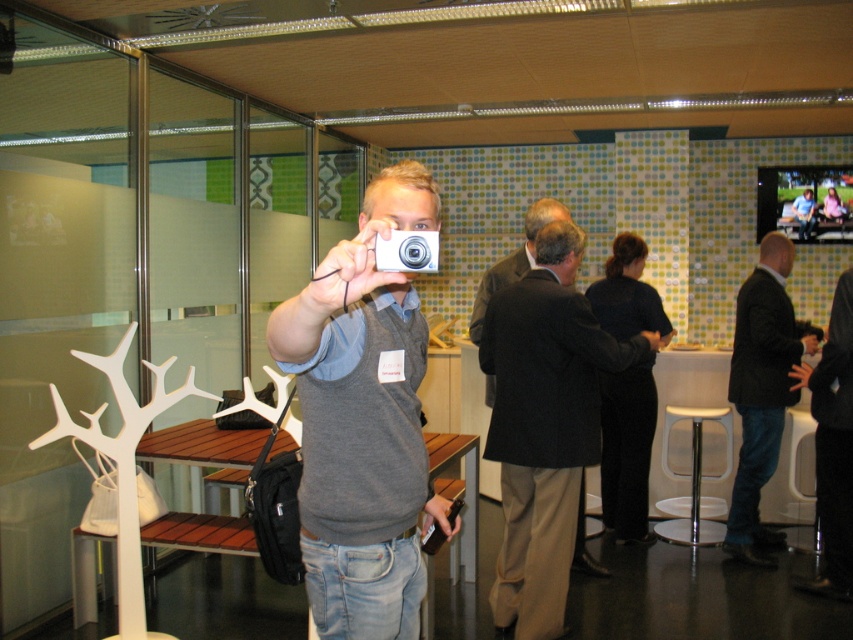
Question: Which object is the farthest from the white plastic stool at lower right?

Choices:
 (A) dark brown leather jacket at right
 (B) silver metallic camera at center
 (C) dark brown suit at center

Answer: (B)

Question: Considering the real-world distances, which object is closest to the dark brown leather jacket at right?

Choices:
 (A) white plastic stool at lower right
 (B) silver metallic camera at center
 (C) dark brown suit at center

Answer: (A)

Question: In this image, where is matte silver camera at center located relative to white plastic stool at lower right?

Choices:
 (A) above
 (B) below

Answer: (A)

Question: Among these points, which one is nearest to the camera?

Choices:
 (A) (706, 410)
 (B) (786, 300)
 (C) (399, 268)
 (D) (316, 502)

Answer: (C)

Question: Is white plastic stool at lower right above silver metallic camera at center?

Choices:
 (A) yes
 (B) no

Answer: (B)

Question: Does dark brown suit at center have a smaller size compared to silver metallic camera at center?

Choices:
 (A) no
 (B) yes

Answer: (A)